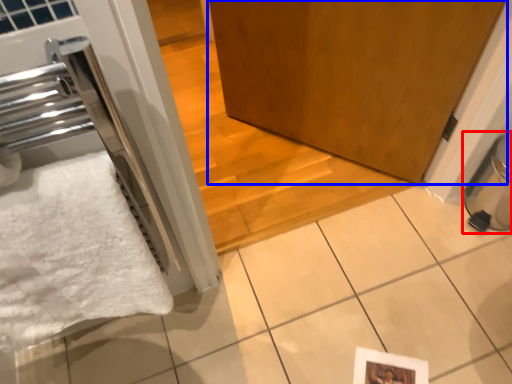
Question: Among these objects, which one is nearest to the camera, water heater (highlighted by a red box) or door (highlighted by a blue box)?

Choices:
 (A) water heater
 (B) door

Answer: (A)